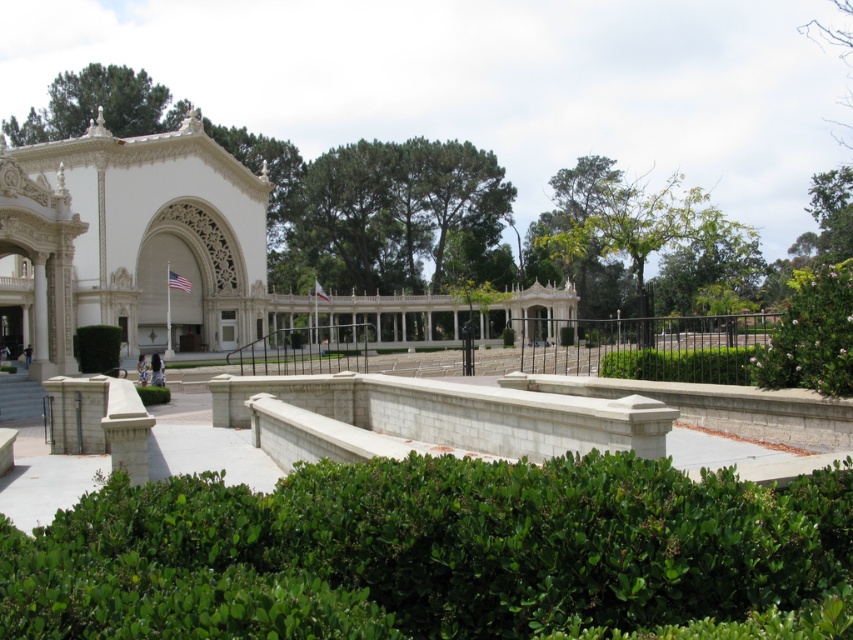
Question: Does green leafy hedge at lower center have a larger size compared to green leafy hedge at center?

Choices:
 (A) no
 (B) yes

Answer: (B)

Question: Which of the following is the farthest from the observer?

Choices:
 (A) white stone palace at center
 (B) green leafy tree at upper center

Answer: (A)

Question: Is white stone palace at left below green leafy tree at upper center?

Choices:
 (A) yes
 (B) no

Answer: (A)

Question: Which object appears closest to the camera in this image?

Choices:
 (A) white stone palace at center
 (B) green leafy hedge at center

Answer: (B)

Question: Is green leafy hedge at lower center above white stone palace at center?

Choices:
 (A) no
 (B) yes

Answer: (A)

Question: Among these objects, which one is farthest from the camera?

Choices:
 (A) green leafy hedge at lower center
 (B) green leafy tree at upper center
 (C) green leafy hedge at center
 (D) white stone palace at center

Answer: (D)